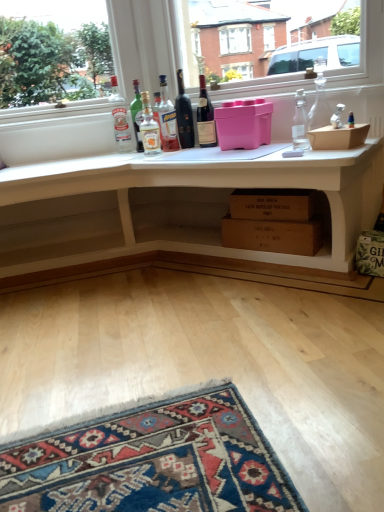
Find the location of `vacant area on the back side of clear glass bottle at upper right, which ranks as the 6th bottle in left-to-right order`. vacant area on the back side of clear glass bottle at upper right, which ranks as the 6th bottle in left-to-right order is located at coordinates (286, 147).